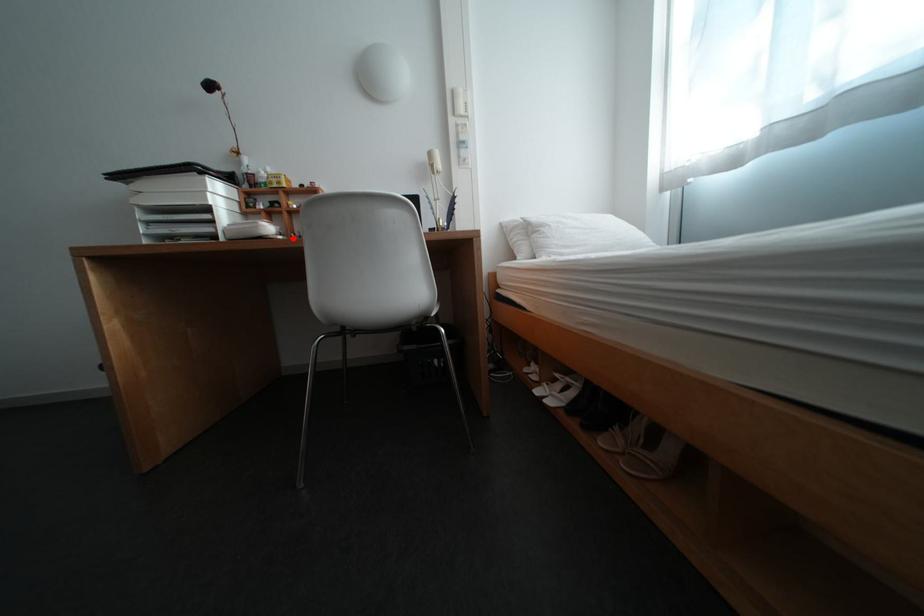
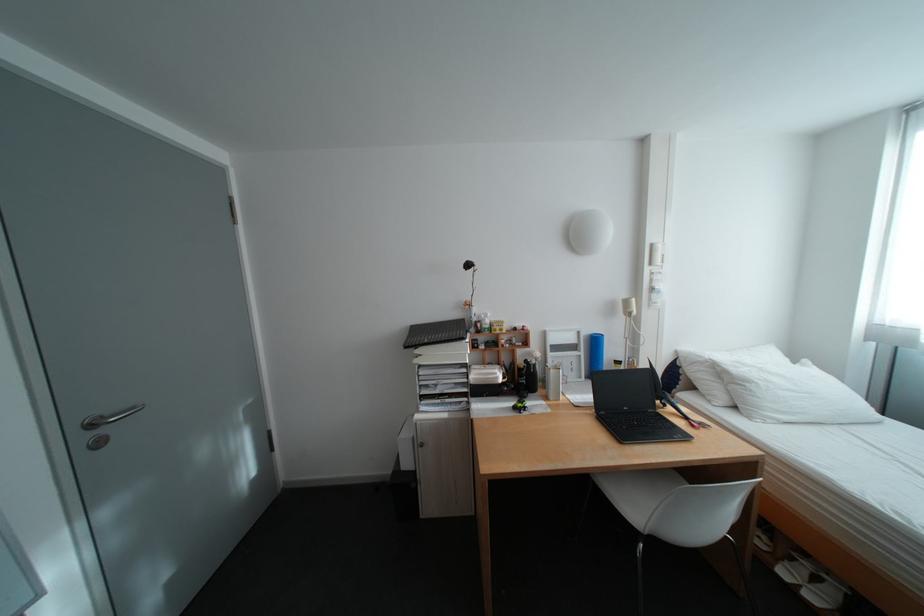
Question: I am providing you with two images of the same scene from different viewpoints. Image1 has a red point marked. In image2, the corresponding 3D location appears at what relative position? Reply with the corresponding letter.

Choices:
 (A) Closer
 (B) Farther

Answer: (B)